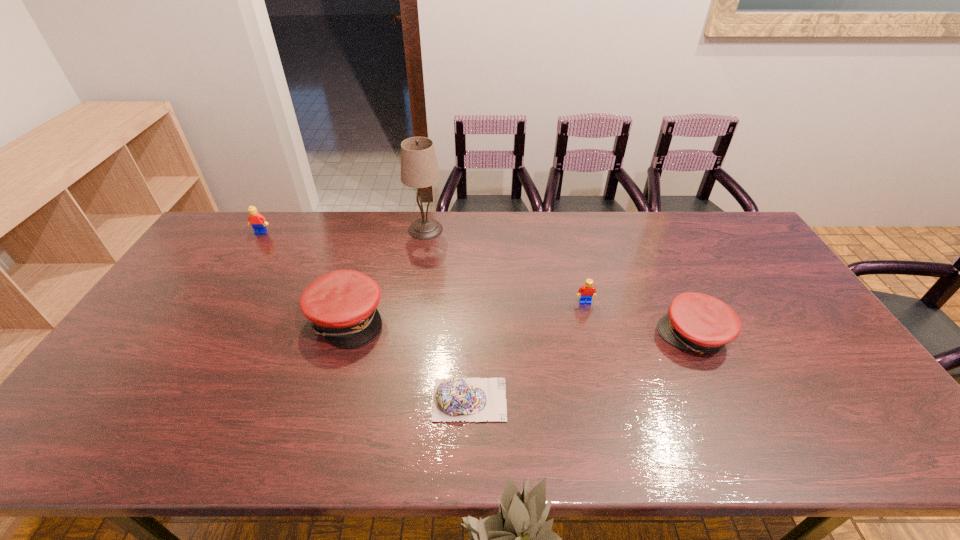
This screenshot has height=540, width=960. I want to click on free space between the tallest cap and the tallest object, so click(x=386, y=274).

This screenshot has height=540, width=960. In order to click on free spot between the fourth object from left to right and the rightmost object in this screenshot , I will do `click(582, 368)`.

Identify the location of free space between the leftmost cap and the fifth object from left to right. (466, 311).

Where is `vacant area that lies between the farther Lego and the second shortest cap`? The image size is (960, 540). vacant area that lies between the farther Lego and the second shortest cap is located at coordinates (477, 284).

At what (x,y) coordinates should I click in order to perform the action: click on vacant point located between the right Lego and the second object from left to right. Please return your answer as a coordinate pair (x, y). This screenshot has height=540, width=960. Looking at the image, I should click on (466, 311).

At what (x,y) coordinates should I click in order to perform the action: click on free area in between the lampshade and the rightmost cap. Please return your answer as a coordinate pair (x, y). The image size is (960, 540). Looking at the image, I should click on (560, 282).

At what (x,y) coordinates should I click in order to perform the action: click on blank region between the left Lego and the shorter Lego. Please return your answer as a coordinate pair (x, y). This screenshot has width=960, height=540. Looking at the image, I should click on (423, 268).

Identify the location of empty space between the second shortest cap and the lampshade. Image resolution: width=960 pixels, height=540 pixels. (560, 282).

Choose which object is the second nearest neighbor to the leftmost cap. Please provide its 2D coordinates. Your answer should be formatted as a tuple, i.e. [(x, y)], where the tuple contains the x and y coordinates of a point satisfying the conditions above.

[(419, 169)]

Identify which object is the nearest to the fourth object from left to right. Please provide its 2D coordinates. Your answer should be formatted as a tuple, i.e. [(x, y)], where the tuple contains the x and y coordinates of a point satisfying the conditions above.

[(341, 305)]